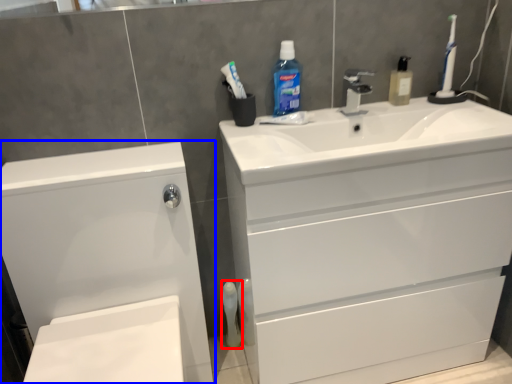
Question: Which of the following is the closest to the observer, mouthwash (highlighted by a red box) or bathroom cabinet (highlighted by a blue box)?

Choices:
 (A) mouthwash
 (B) bathroom cabinet

Answer: (B)